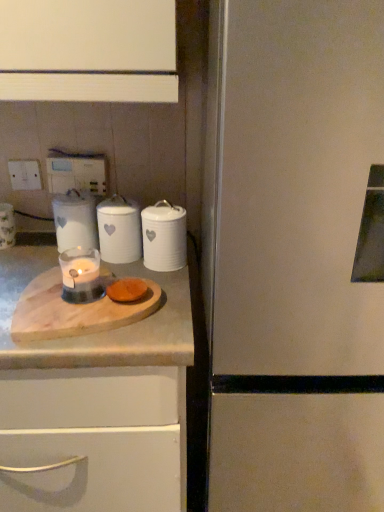
Where is `vacant space situated above wooden cutting board at center, which is counted as the second countertop, starting from the bottom (from a real-world perspective)`? This screenshot has height=512, width=384. vacant space situated above wooden cutting board at center, which is counted as the second countertop, starting from the bottom (from a real-world perspective) is located at coordinates (69, 302).